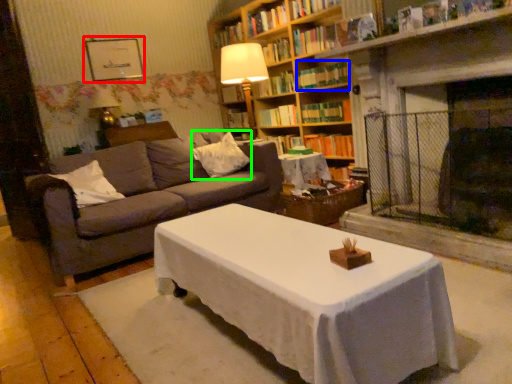
Question: Considering the real-world distances, which object is farthest from picture frame (highlighted by a red box)? book (highlighted by a blue box) or pillow (highlighted by a green box)?

Choices:
 (A) book
 (B) pillow

Answer: (A)